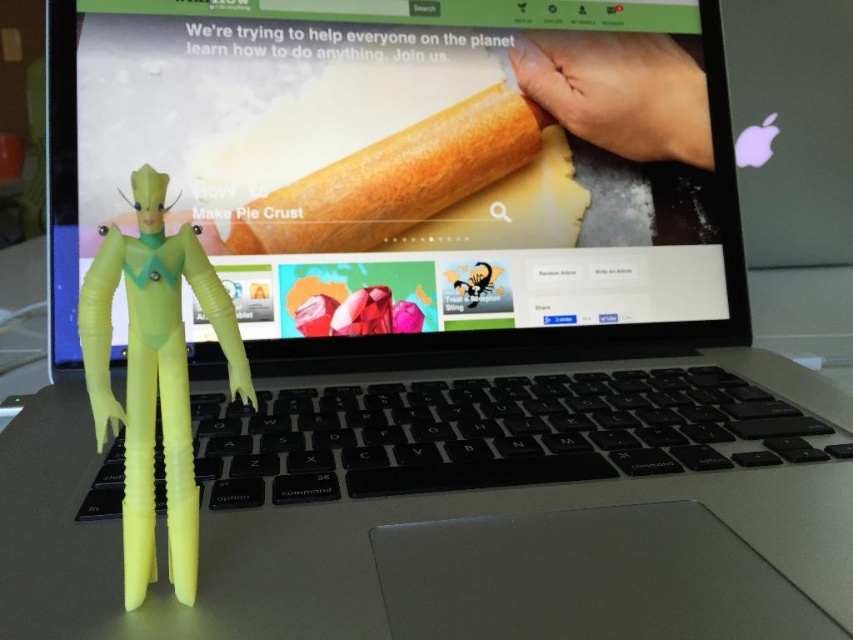
You are a delivery robot that needs to place a small package between the translucent yellow plastic figure at center and the smooth skin hand at upper right. The package is 30 centimeters long. Can you fit it between them without moving either object?

The distance between the translucent yellow plastic figure at center and the smooth skin hand at upper right is 60.94 centimeters. Since the package is 30 centimeters long, it can fit between them as there is enough space.

You are a photographer taking a picture of the laptop screen and the figurine. You want to focus on the figurine first. Which point should you focus on first, point (80, 90) or point (764, 465)?

Point (80, 90) is further to the camera than point (764, 465), so you should focus on point (80, 90) first to ensure the figurine is in focus.